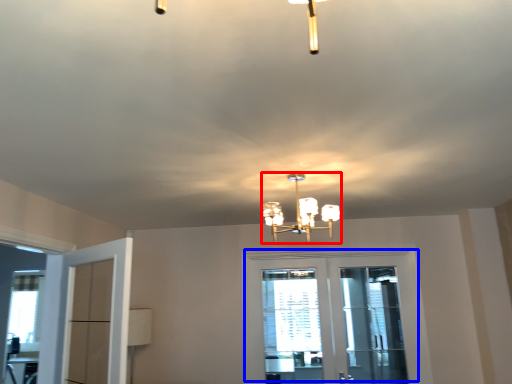
Question: Which point is further to the camera, lamp (highlighted by a red box) or door (highlighted by a blue box)?

Choices:
 (A) lamp
 (B) door

Answer: (B)